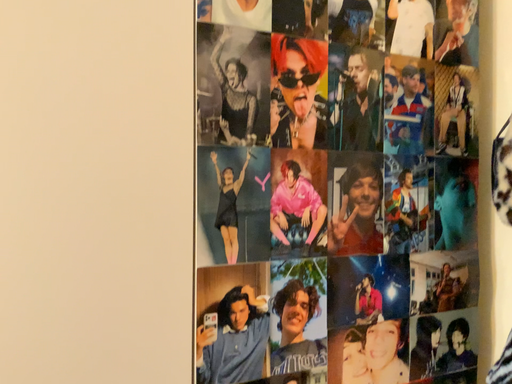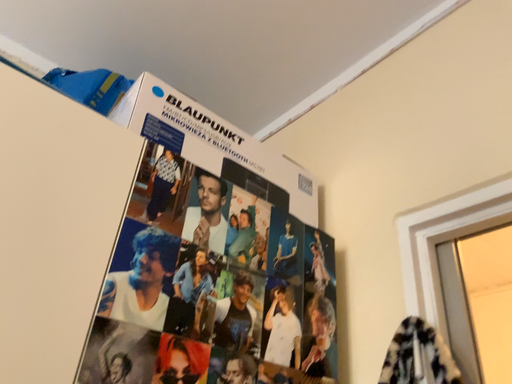
Question: How did the camera likely rotate when shooting the video?

Choices:
 (A) rotated upward
 (B) rotated downward

Answer: (A)